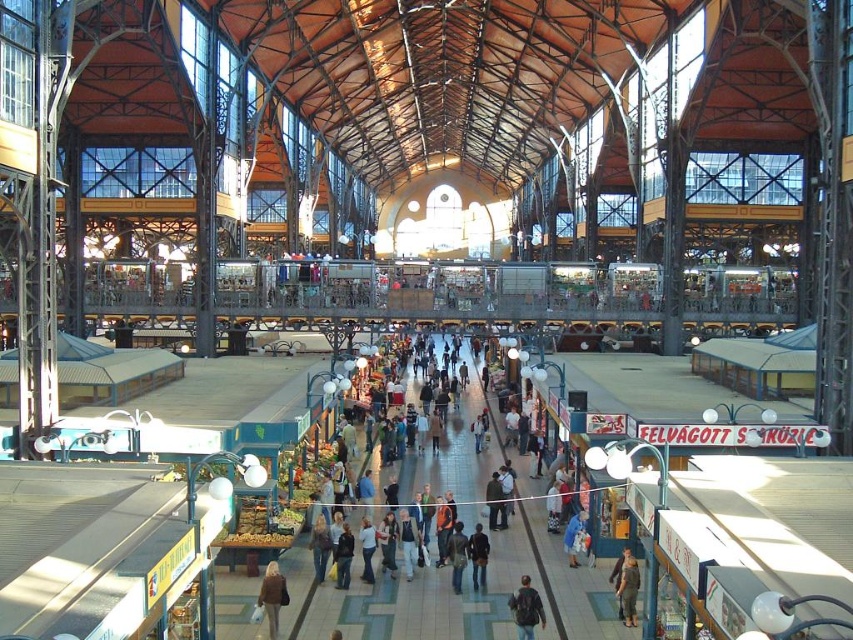
Between point (627, 566) and point (469, 557), which one is positioned in front?

Positioned in front is point (627, 566).

Does point (619, 579) come farther from viewer compared to point (477, 528)?

No, (619, 579) is in front of (477, 528).

Locate an element on the screen. The height and width of the screenshot is (640, 853). brown fabric pants at center is located at coordinates (628, 589).

Who is taller, dark brown leather backpack at center or brown leather jacket at center?

Standing taller between the two is brown leather jacket at center.

Is point (511, 605) positioned in front of point (281, 604)?

Yes, point (511, 605) is closer to viewer.

The height and width of the screenshot is (640, 853). What do you see at coordinates (526, 609) in the screenshot?
I see `dark brown leather backpack at center` at bounding box center [526, 609].

Image resolution: width=853 pixels, height=640 pixels. What are the coordinates of `dark brown leather backpack at center` in the screenshot? It's located at (526, 609).

Is brown leather jacket at center to the right of dark brown leather jacket at center from the viewer's perspective?

No, brown leather jacket at center is not to the right of dark brown leather jacket at center.

Consider the image. Is brown leather jacket at center closer to the viewer compared to dark brown leather jacket at center?

Yes, brown leather jacket at center is in front of dark brown leather jacket at center.

Who is more distant from viewer, (263, 602) or (479, 540)?

The point (479, 540) is behind.

Locate an element on the screen. brown leather jacket at center is located at coordinates (271, 596).